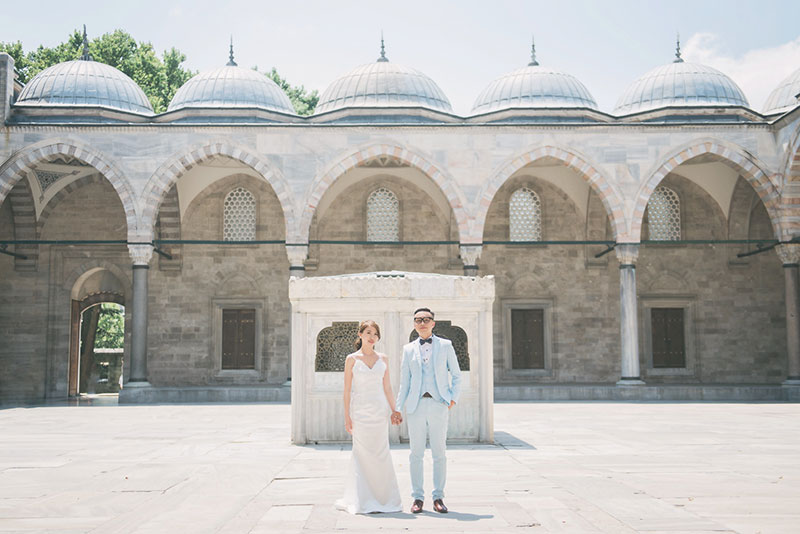
Identify the location of windows. The height and width of the screenshot is (534, 800). click(x=230, y=339), click(x=532, y=354), click(x=674, y=345), click(x=238, y=223), click(x=389, y=227), click(x=517, y=219), click(x=670, y=216).